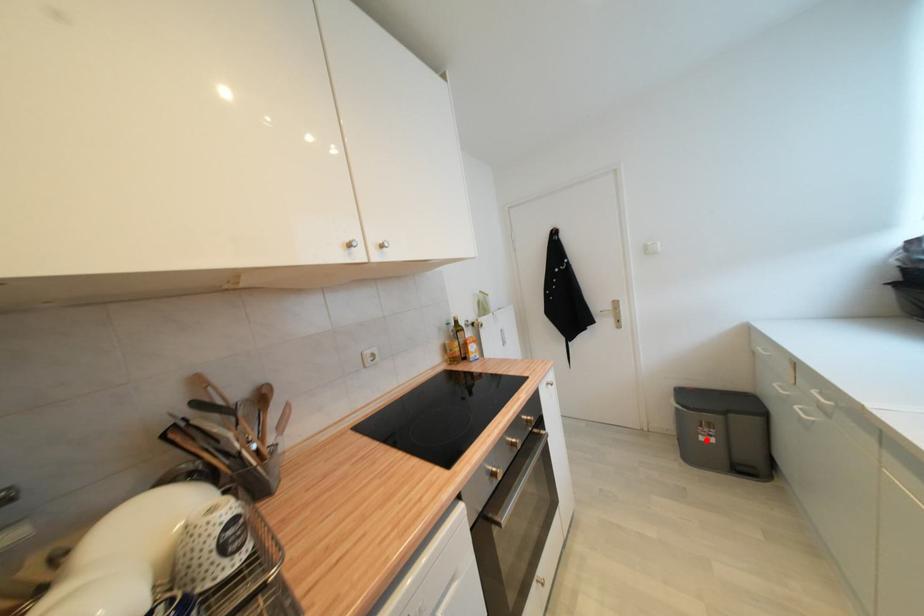
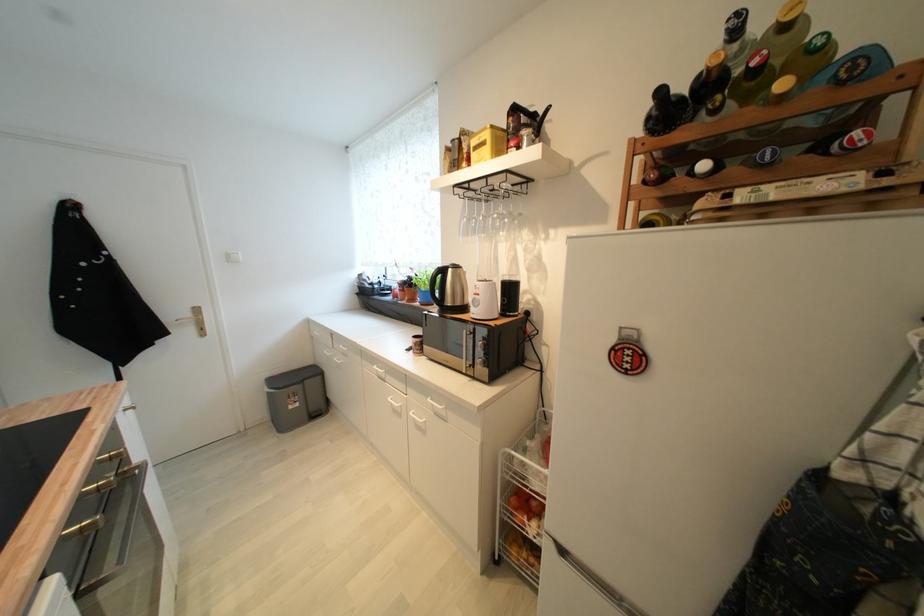
The point at the highlighted location is marked in the first image. Where is the corresponding point in the second image?

(296, 408)